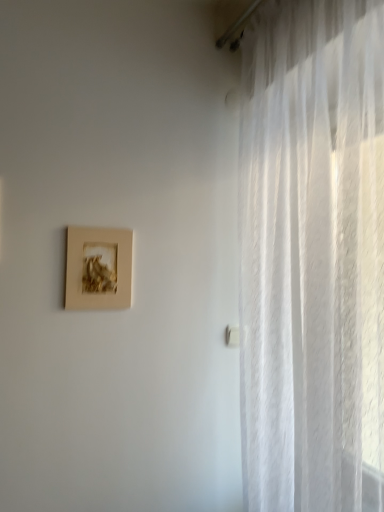
The image size is (384, 512). Find the location of `matte gold picture frame at upper left`. matte gold picture frame at upper left is located at coordinates (98, 268).

What is the approximate width of matte gold picture frame at upper left?

matte gold picture frame at upper left is 1.60 inches wide.

What do you see at coordinates (98, 268) in the screenshot? The height and width of the screenshot is (512, 384). I see `matte gold picture frame at upper left` at bounding box center [98, 268].

Locate an element on the screen. white sheer curtain at right is located at coordinates (312, 256).

The image size is (384, 512). What do you see at coordinates (312, 256) in the screenshot?
I see `white sheer curtain at right` at bounding box center [312, 256].

Where is `matte gold picture frame at upper left`? Image resolution: width=384 pixels, height=512 pixels. matte gold picture frame at upper left is located at coordinates tap(98, 268).

Which object is positioned more to the left, white sheer curtain at right or matte gold picture frame at upper left?

matte gold picture frame at upper left is more to the left.

Between white sheer curtain at right and matte gold picture frame at upper left, which one is positioned behind?

matte gold picture frame at upper left is further away from the camera.

Is point (300, 325) positioned behind point (71, 289)?

No, it is in front of (71, 289).

From the image's perspective, is white sheer curtain at right located above or below matte gold picture frame at upper left?

white sheer curtain at right is situated lower than matte gold picture frame at upper left in the image.

From a real-world perspective, is white sheer curtain at right beneath matte gold picture frame at upper left?

Yes, from a real-world perspective, white sheer curtain at right is under matte gold picture frame at upper left.

From the picture: Which object is wider, white sheer curtain at right or matte gold picture frame at upper left?

white sheer curtain at right is wider.

Considering the sizes of white sheer curtain at right and matte gold picture frame at upper left in the image, is white sheer curtain at right taller or shorter than matte gold picture frame at upper left?

Clearly, white sheer curtain at right is taller compared to matte gold picture frame at upper left.

Can you confirm if white sheer curtain at right is bigger than matte gold picture frame at upper left?

Yes, white sheer curtain at right is bigger than matte gold picture frame at upper left.

Would you say white sheer curtain at right is outside matte gold picture frame at upper left?

Yes, white sheer curtain at right is outside of matte gold picture frame at upper left.

Is white sheer curtain at right far away from matte gold picture frame at upper left?

No, white sheer curtain at right is in close proximity to matte gold picture frame at upper left.

Is white sheer curtain at right looking in the opposite direction of matte gold picture frame at upper left?

No, white sheer curtain at right's orientation is not away from matte gold picture frame at upper left.

Identify the location of picture frame above the white sheer curtain at right (from a real-world perspective). The width and height of the screenshot is (384, 512). (98, 268).

Does matte gold picture frame at upper left appear on the right side of white sheer curtain at right?

No, matte gold picture frame at upper left is not to the right of white sheer curtain at right.

Which object is further away from the camera, matte gold picture frame at upper left or white sheer curtain at right?

Positioned behind is matte gold picture frame at upper left.

Which is nearer, (97,303) or (290,442)?

Point (97,303) is farther from the camera than point (290,442).

From the image's perspective, does matte gold picture frame at upper left appear lower than white sheer curtain at right?

Incorrect, from the image's perspective, matte gold picture frame at upper left is higher than white sheer curtain at right.

From a real-world perspective, which object stands above the other?

matte gold picture frame at upper left is physically above.

Considering the sizes of matte gold picture frame at upper left and white sheer curtain at right in the image, is matte gold picture frame at upper left wider or thinner than white sheer curtain at right?

Considering their sizes, matte gold picture frame at upper left looks slimmer than white sheer curtain at right.

Is matte gold picture frame at upper left taller than white sheer curtain at right?

No, matte gold picture frame at upper left is not taller than white sheer curtain at right.

Considering the relative sizes of matte gold picture frame at upper left and white sheer curtain at right in the image provided, is matte gold picture frame at upper left bigger than white sheer curtain at right?

No, matte gold picture frame at upper left is not bigger than white sheer curtain at right.

Is matte gold picture frame at upper left not within white sheer curtain at right?

Yes.

Is the surface of matte gold picture frame at upper left in direct contact with white sheer curtain at right?

No, matte gold picture frame at upper left is not with white sheer curtain at right.

Is matte gold picture frame at upper left oriented towards white sheer curtain at right?

No, matte gold picture frame at upper left does not turn towards white sheer curtain at right.

From the picture: What's the angular difference between matte gold picture frame at upper left and white sheer curtain at right's facing directions?

There is a 90-degree angle between the facing directions of matte gold picture frame at upper left and white sheer curtain at right.

This screenshot has width=384, height=512. I want to click on curtain in front of the matte gold picture frame at upper left, so click(x=312, y=256).

Where is `curtain that appears below the matte gold picture frame at upper left (from the image's perspective)`? Image resolution: width=384 pixels, height=512 pixels. curtain that appears below the matte gold picture frame at upper left (from the image's perspective) is located at coordinates (x=312, y=256).

Identify the location of picture frame above the white sheer curtain at right (from a real-world perspective). (98, 268).